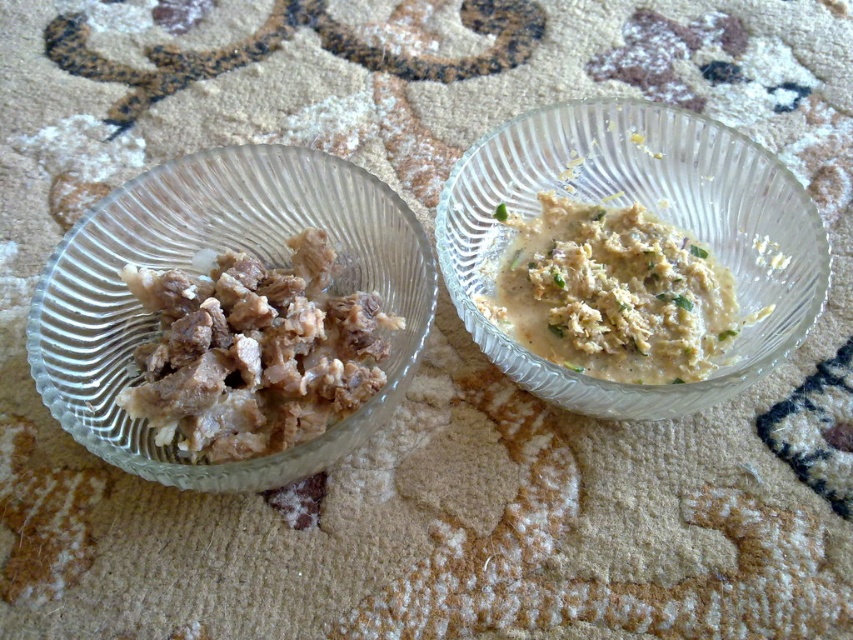
Is brown meat at left behind white creamy paste at center?

No, brown meat at left is closer to the viewer.

Between point (196, 346) and point (624, 326), which one is positioned behind?

The point (624, 326) is behind.

The image size is (853, 640). In order to click on brown meat at left in this screenshot , I will do `click(254, 353)`.

Is clear glass bowl at left shorter than clear glass bowl at upper right?

Yes, clear glass bowl at left is shorter than clear glass bowl at upper right.

Does point (192, 484) come in front of point (676, 180)?

That is True.

Find the location of `clear glass bowl at left`. clear glass bowl at left is located at coordinates (194, 269).

Which is more to the right, clear glass bowl at upper right or brown meat at left?

clear glass bowl at upper right is more to the right.

Between point (711, 227) and point (184, 348), which one is positioned in front?

Positioned in front is point (184, 348).

I want to click on clear glass bowl at upper right, so click(x=653, y=212).